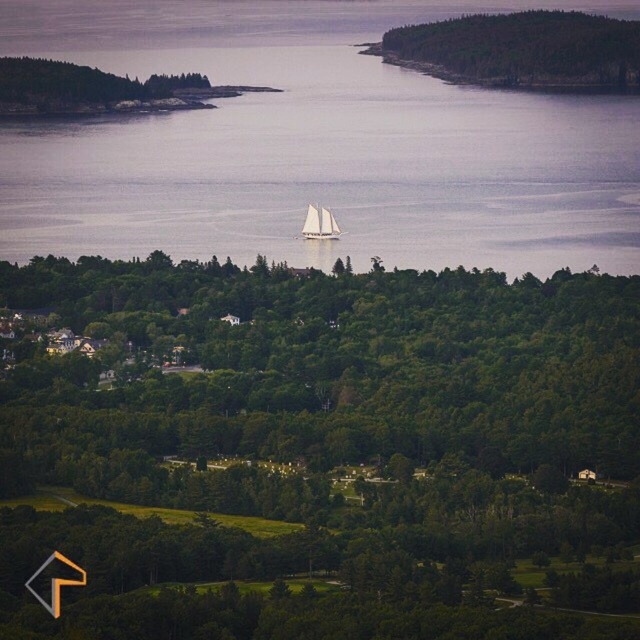
Question: Which is farther from the green leafy tree at center?

Choices:
 (A) clear water at center
 (B) white sailboat at center

Answer: (B)

Question: Can you confirm if green leafy tree at center is thinner than white sailboat at center?

Choices:
 (A) yes
 (B) no

Answer: (B)

Question: Observing the image, what is the correct spatial positioning of green leafy tree at center in reference to white sailboat at center?

Choices:
 (A) left
 (B) right

Answer: (A)

Question: Which is farther from the green leafy tree at center?

Choices:
 (A) clear water at center
 (B) white sailboat at center

Answer: (B)

Question: Does green leafy tree at center appear over clear water at center?

Choices:
 (A) no
 (B) yes

Answer: (A)

Question: Which is nearer to the clear water at center?

Choices:
 (A) green leafy tree at center
 (B) white sailboat at center

Answer: (B)